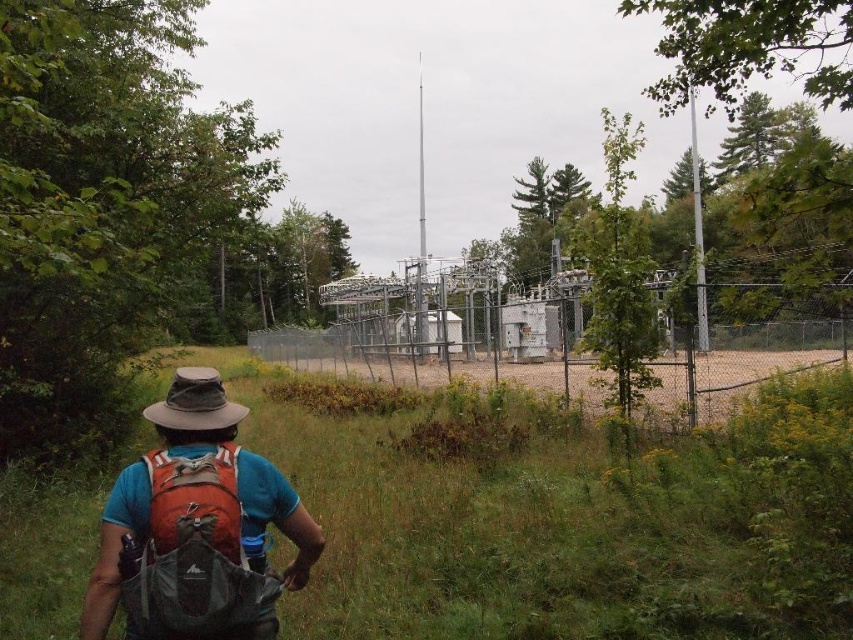
Between point (213, 605) and point (219, 420), which one is positioned in front?

Point (213, 605) is in front.

Who is more forward, (91, 598) or (215, 390)?

Point (91, 598) is more forward.

In order to click on matte orange backpack at center in this screenshot , I will do [196, 528].

The image size is (853, 640). What are the coordinates of `brown sandy dirt field at center` in the screenshot? It's located at (746, 372).

Which is below, brown sandy dirt field at center or brown fabric hat at upper center?

brown sandy dirt field at center is lower down.

Where is `brown sandy dirt field at center`? Image resolution: width=853 pixels, height=640 pixels. brown sandy dirt field at center is located at coordinates (746, 372).

Is point (554, 504) in front of point (195, 376)?

That is False.

Between point (347, 451) and point (196, 417), which one is positioned in front?

Point (196, 417)

Image resolution: width=853 pixels, height=640 pixels. Describe the element at coordinates (506, 524) in the screenshot. I see `green grass at center` at that location.

Image resolution: width=853 pixels, height=640 pixels. What are the coordinates of `green grass at center` in the screenshot? It's located at (506, 524).